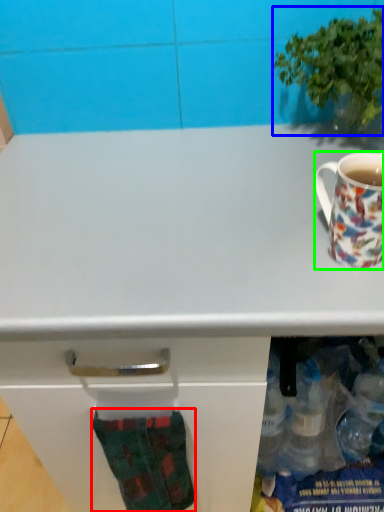
Question: Considering the real-world distances, which object is farthest from sock (highlighted by a red box)? houseplant (highlighted by a blue box) or coffee cup (highlighted by a green box)?

Choices:
 (A) houseplant
 (B) coffee cup

Answer: (A)